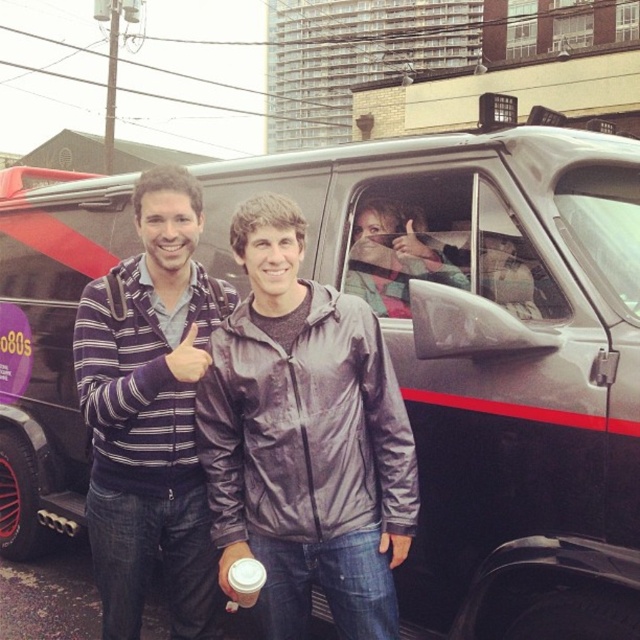
Is the position of shiny black jacket at center more distant than that of matte plastic hand at upper center?

No, shiny black jacket at center is closer to the viewer.

Between shiny black jacket at center and matte plastic hand at upper center, which one is positioned lower?

shiny black jacket at center is below.

What do you see at coordinates (305, 438) in the screenshot? I see `shiny black jacket at center` at bounding box center [305, 438].

I want to click on shiny black jacket at center, so click(x=305, y=438).

Which is above, shiny black jacket at center or plaid fabric shirt at center?

plaid fabric shirt at center is higher up.

The height and width of the screenshot is (640, 640). What do you see at coordinates (305, 438) in the screenshot? I see `shiny black jacket at center` at bounding box center [305, 438].

Is point (388, 563) closer to viewer compared to point (444, 262)?

That is True.

The height and width of the screenshot is (640, 640). What are the coordinates of `shiny black jacket at center` in the screenshot? It's located at (305, 438).

Is striped sweater at center to the right of matte plastic hand at upper center from the viewer's perspective?

In fact, striped sweater at center is to the left of matte plastic hand at upper center.

Is point (198, 620) closer to viewer compared to point (429, 248)?

Yes, it is.

The image size is (640, 640). I want to click on striped sweater at center, so click(x=148, y=412).